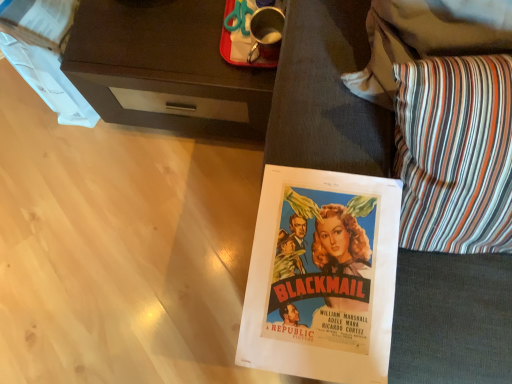
Question: Does striped fabric pillow at lower right lie behind dark wood desk at upper left?

Choices:
 (A) yes
 (B) no

Answer: (B)

Question: Is striped fabric pillow at lower right turned away from dark wood desk at upper left?

Choices:
 (A) no
 (B) yes

Answer: (A)

Question: Is dark wood desk at upper left completely or partially inside striped fabric pillow at lower right?

Choices:
 (A) yes
 (B) no

Answer: (B)

Question: Would you say striped fabric pillow at lower right is outside dark wood desk at upper left?

Choices:
 (A) no
 (B) yes

Answer: (B)

Question: Can you confirm if striped fabric pillow at lower right is taller than dark wood desk at upper left?

Choices:
 (A) no
 (B) yes

Answer: (A)

Question: Considering the relative sizes of striped fabric pillow at lower right and dark wood desk at upper left in the image provided, is striped fabric pillow at lower right wider than dark wood desk at upper left?

Choices:
 (A) no
 (B) yes

Answer: (A)

Question: Is dark wood desk at upper left closer to camera compared to striped fabric pillow at lower right?

Choices:
 (A) yes
 (B) no

Answer: (B)

Question: Is the depth of dark wood desk at upper left greater than that of striped fabric pillow at lower right?

Choices:
 (A) yes
 (B) no

Answer: (A)

Question: Does dark wood desk at upper left appear on the left side of striped fabric pillow at lower right?

Choices:
 (A) no
 (B) yes

Answer: (B)

Question: Can you confirm if dark wood desk at upper left is thinner than striped fabric pillow at lower right?

Choices:
 (A) no
 (B) yes

Answer: (A)

Question: Is dark wood desk at upper left not within striped fabric pillow at lower right?

Choices:
 (A) yes
 (B) no

Answer: (A)

Question: Is dark wood desk at upper left oriented towards striped fabric pillow at lower right?

Choices:
 (A) no
 (B) yes

Answer: (A)

Question: Based on their positions, is striped fabric pillow at lower right located to the left or right of dark wood desk at upper left?

Choices:
 (A) right
 (B) left

Answer: (A)